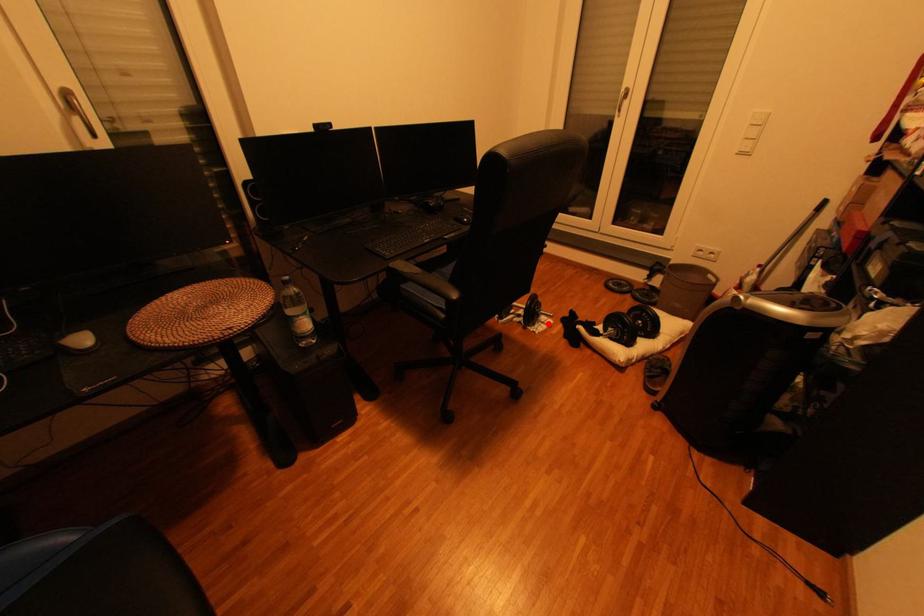
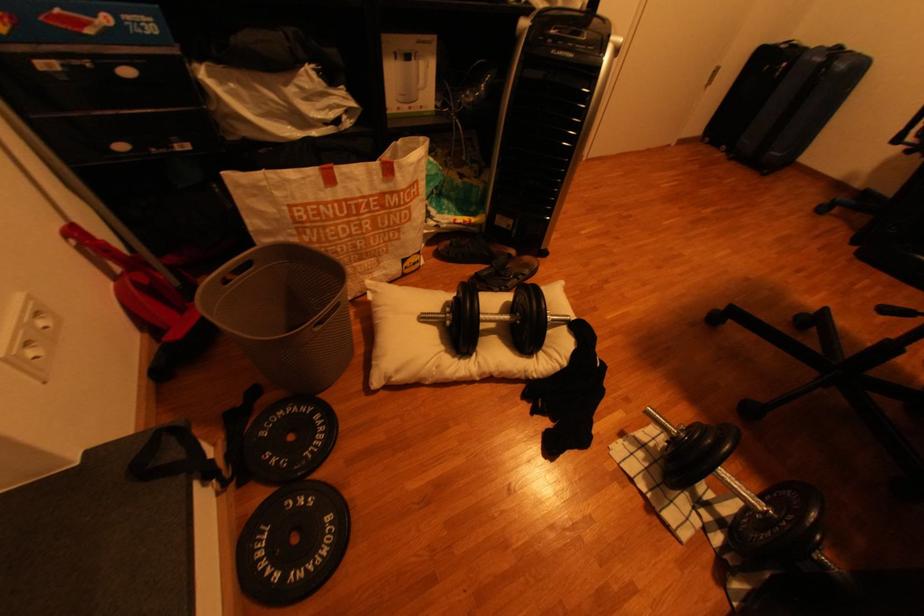
The point at the highlighted location is marked in the first image. Where is the corresponding point in the second image?

(665, 446)